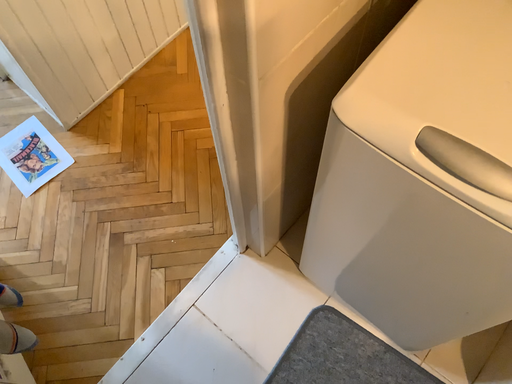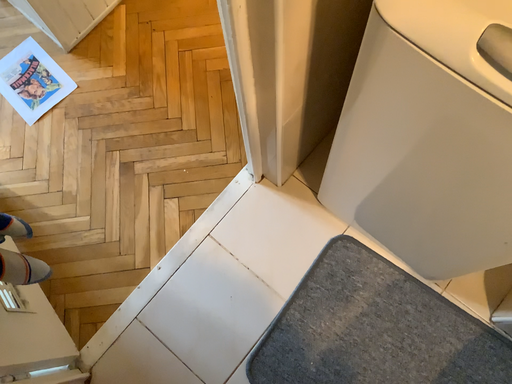
Question: How did the camera likely rotate when shooting the video?

Choices:
 (A) rotated downward
 (B) rotated upward

Answer: (A)